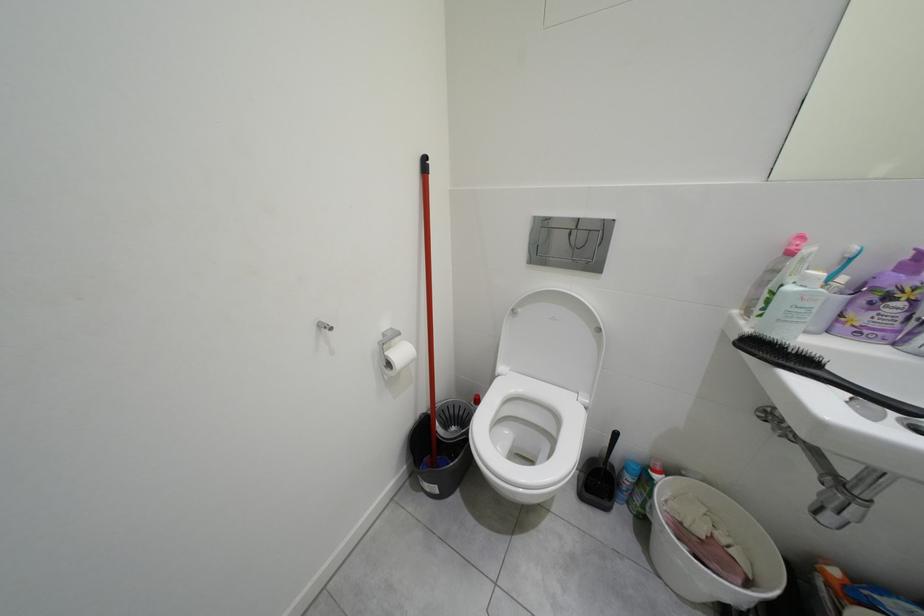
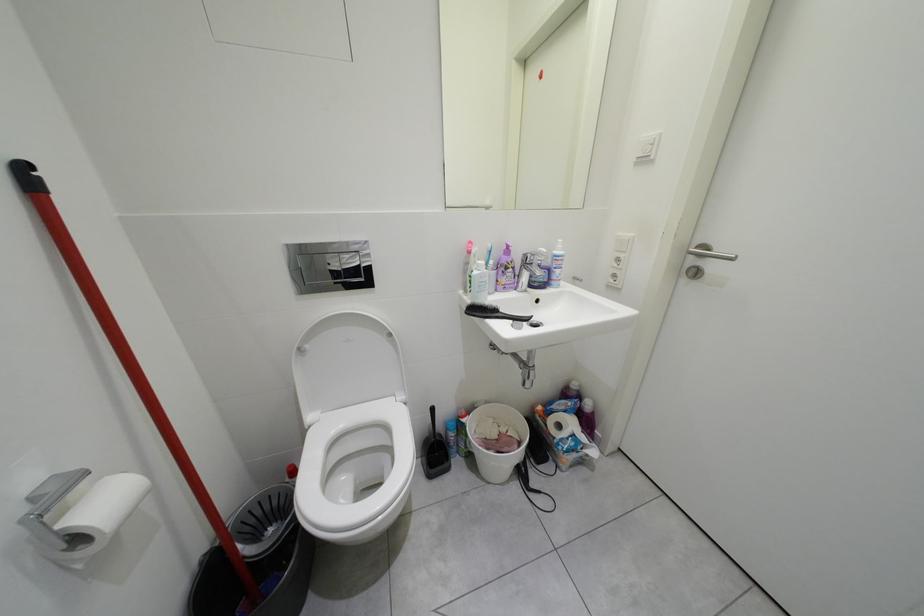
Question: The camera is either moving clockwise (left) or counter-clockwise (right) around the object. The first image is from the beginning of the video and the second image is from the end. Is the camera moving left or right when shooting the video?

Choices:
 (A) Left
 (B) Right

Answer: (A)